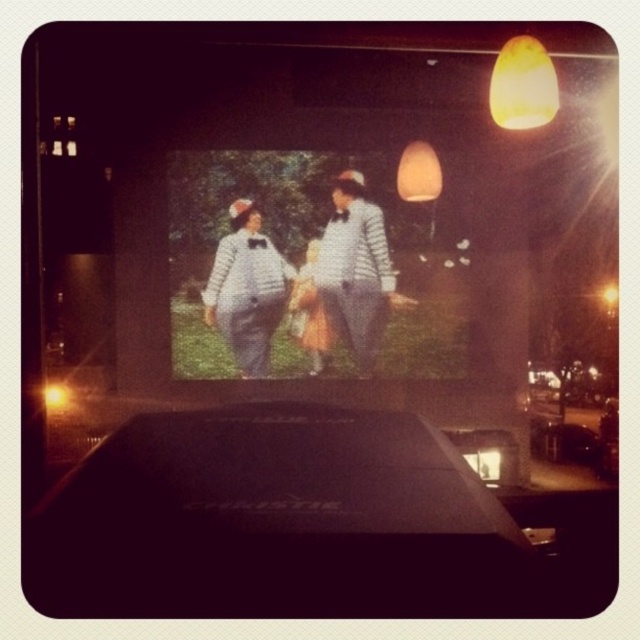
Question: Does striped fabric characters at center have a greater width compared to yellow matte lampshade at upper right?

Choices:
 (A) yes
 (B) no

Answer: (A)

Question: Which of the following is the closest to the observer?

Choices:
 (A) (516, 52)
 (B) (339, 224)
 (C) (241, 339)
 (D) (380, 289)

Answer: (A)

Question: Which object appears farthest from the camera in this image?

Choices:
 (A) striped fabric characters at center
 (B) striped fabric dress at center

Answer: (B)

Question: Can you confirm if striped fabric characters at center is bigger than matte yellow lampshade at upper center?

Choices:
 (A) no
 (B) yes

Answer: (B)

Question: Among these objects, which one is nearest to the camera?

Choices:
 (A) yellow matte lampshade at upper right
 (B) striped fabric dress at center
 (C) matte yellow lampshade at upper center

Answer: (A)

Question: Does striped fabric characters at center lie in front of matte yellow lampshade at upper center?

Choices:
 (A) no
 (B) yes

Answer: (A)